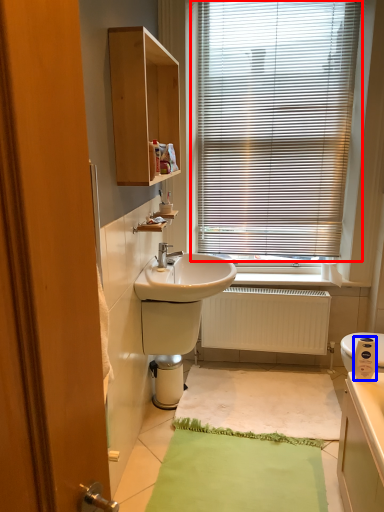
Question: Among these objects, which one is farthest to the camera, window blind (highlighted by a red box) or appliance (highlighted by a blue box)?

Choices:
 (A) window blind
 (B) appliance

Answer: (A)